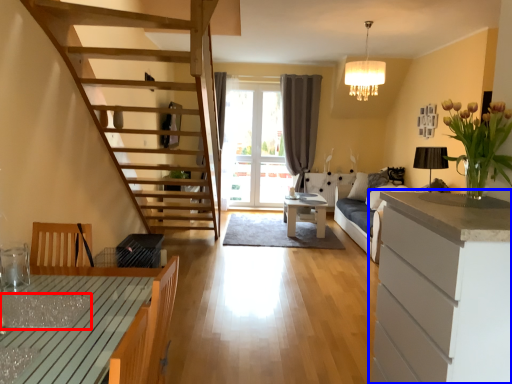
Question: Which object appears farthest to the camera in this image, glass table (highlighted by a red box) or cabinetry (highlighted by a blue box)?

Choices:
 (A) glass table
 (B) cabinetry

Answer: (A)